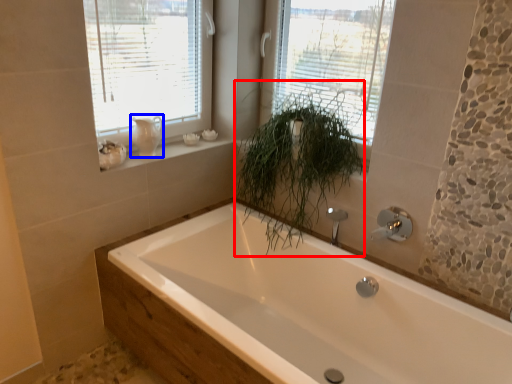
Question: Which object is further to the camera taking this photo, plant (highlighted by a red box) or gray (highlighted by a blue box)?

Choices:
 (A) plant
 (B) gray

Answer: (B)